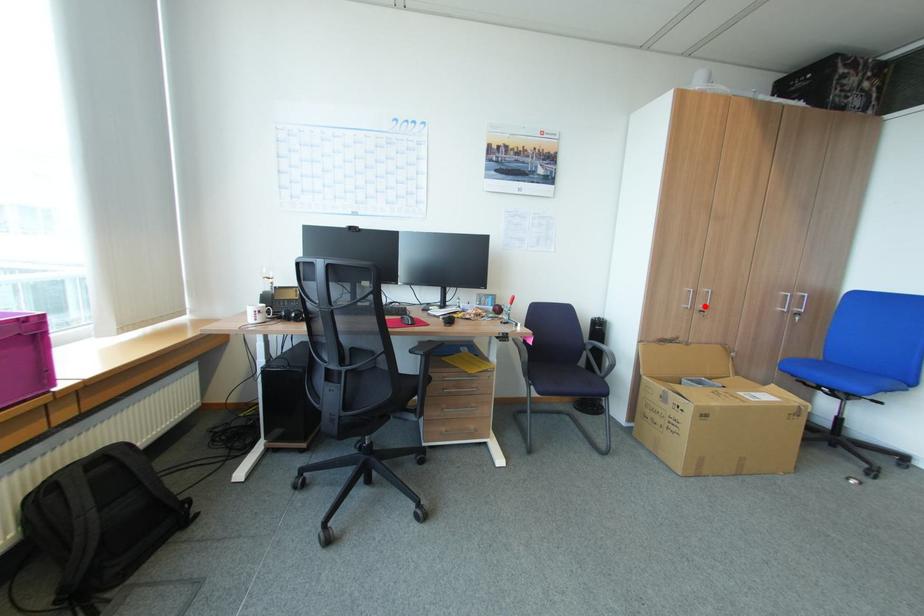
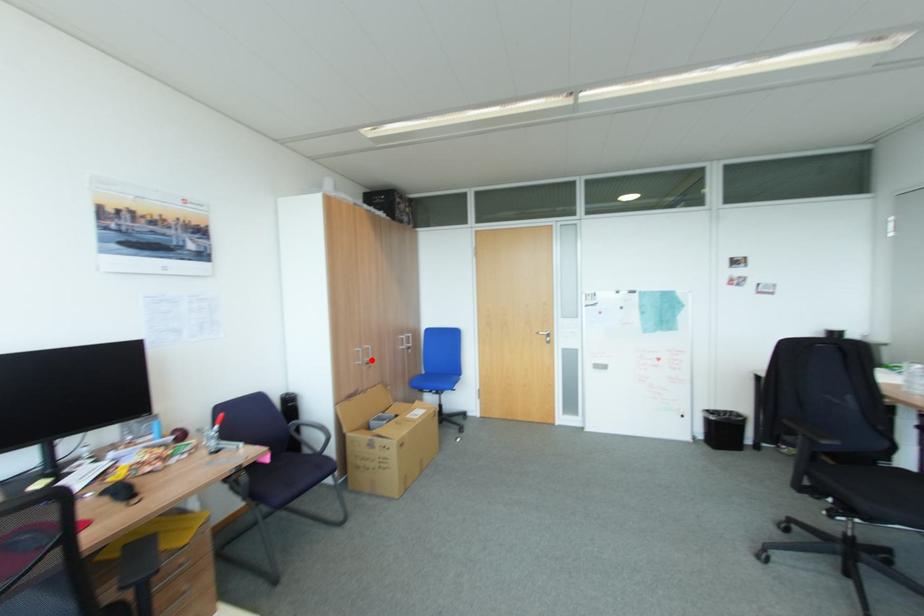
I am providing you with two images of the same scene from different viewpoints. A red point is marked on the first image and another point is marked on the second image. Does the point marked in image1 correspond to the same location as the one in image2?

Yes